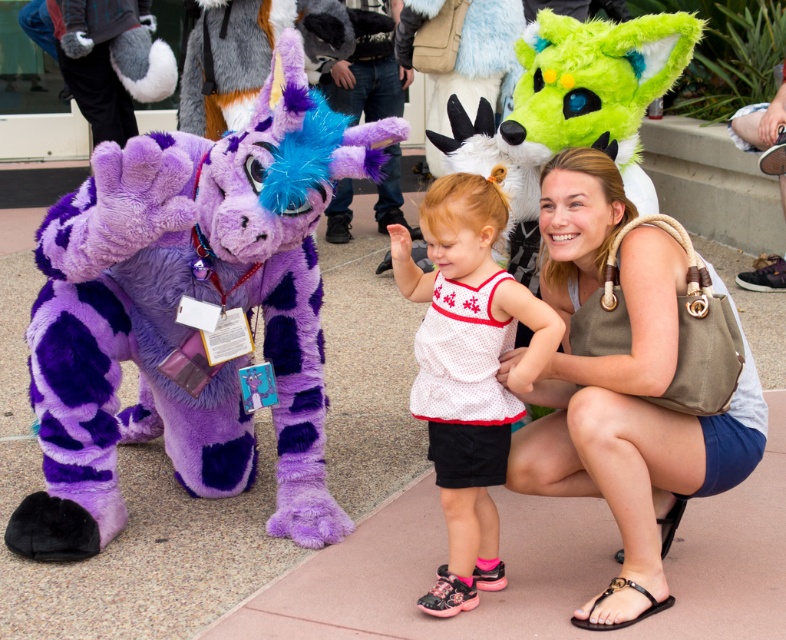
Can you confirm if olive-green fabric purse at center-right is taller than white mesh top at center?

Yes.

Is point (573, 248) positioned before point (461, 256)?

No.

The height and width of the screenshot is (640, 786). Identify the location of olive-green fabric purse at center-right. (623, 388).

Which is behind, point (127, 218) or point (546, 291)?

Positioned behind is point (546, 291).

Between point (314, 545) and point (581, 208), which one is positioned behind?

The point (314, 545) is behind.

You are a GUI agent. You are given a task and a screenshot of the screen. Output one action in this format:
    pyautogui.click(x=<x>, y=<y>)
    Task: Click on the purple plush at left
    This screenshot has width=786, height=640.
    Given the screenshot: What is the action you would take?
    pyautogui.click(x=182, y=324)

Consider the image. Does purple plush at left come in front of white mesh top at center?

That is True.

The width and height of the screenshot is (786, 640). What are the coordinates of `purple plush at left` in the screenshot? It's located at (182, 324).

Where is `purple plush at left`? purple plush at left is located at coordinates (182, 324).